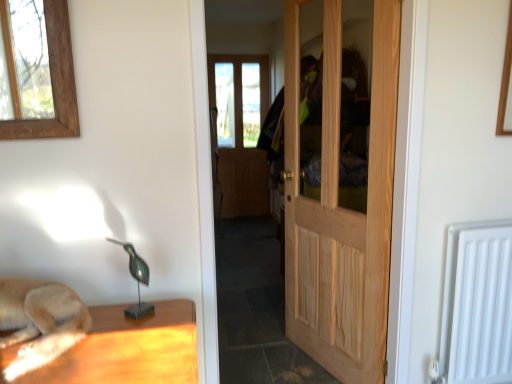
Question: Is point (384, 61) closer or farther from the camera than point (140, 278)?

Choices:
 (A) farther
 (B) closer

Answer: (A)

Question: From a real-world perspective, is natural wood door at center positioned above or below green metallic bird at center?

Choices:
 (A) below
 (B) above

Answer: (B)

Question: Which of these objects is positioned closest to the green metallic bird at center?

Choices:
 (A) white matte radiator at lower right
 (B) natural wood door at center

Answer: (B)

Question: Which object is the farthest from the natural wood door at center?

Choices:
 (A) white matte radiator at lower right
 (B) green metallic bird at center

Answer: (B)